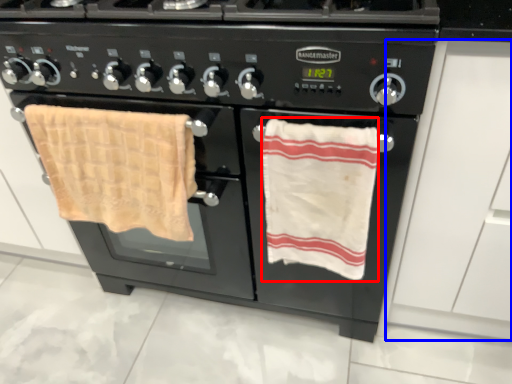
Question: Which object is closer to the camera taking this photo, beach towel (highlighted by a red box) or drawer (highlighted by a blue box)?

Choices:
 (A) beach towel
 (B) drawer

Answer: (B)